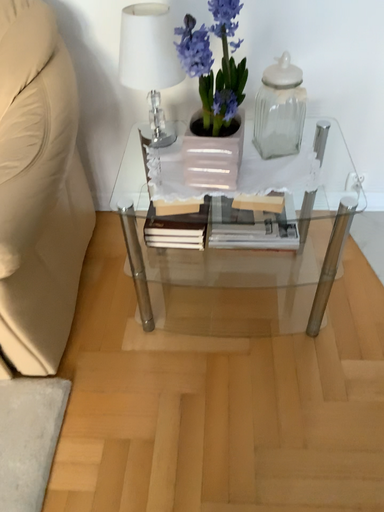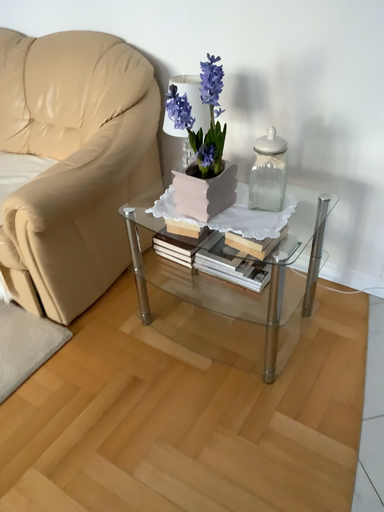
Question: Which way did the camera rotate in the video?

Choices:
 (A) rotated left
 (B) rotated right

Answer: (A)